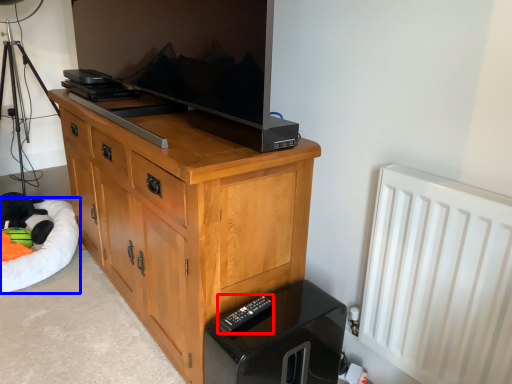
Question: Which point is closer to the camera, remote (highlighted by a red box) or dog bed (highlighted by a blue box)?

Choices:
 (A) remote
 (B) dog bed

Answer: (A)